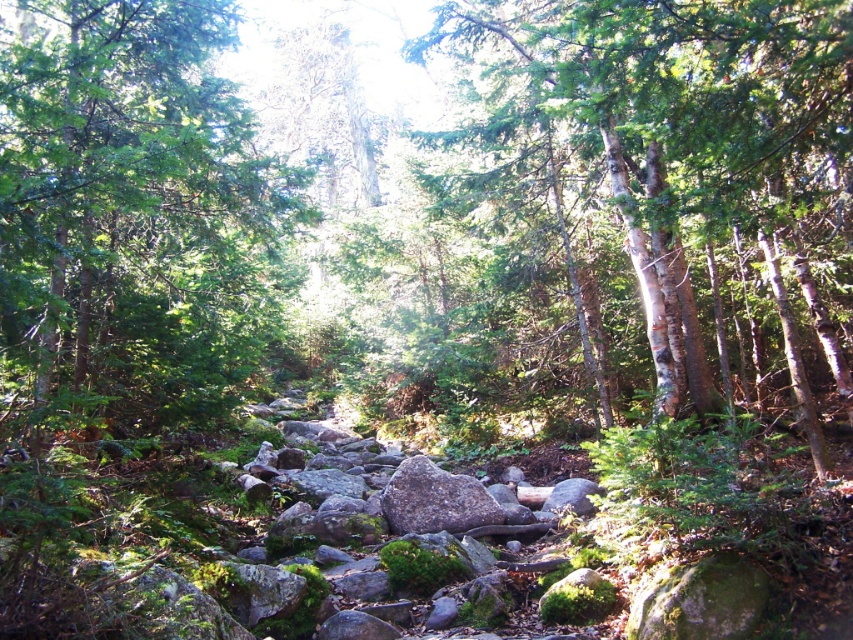
You are a hiker who wants to take a photo of both the smooth bark tree at center and the green leafy tree at center. Since you want them both in the frame, which tree should you stand closer to when taking the photo?

You should stand closer to the green leafy tree at center because it is shorter than the smooth bark tree at center. This way, both trees will appear balanced in the photo frame.

You are a hiker walking along the rocky path in the forest scene. You notice two trees at the center of your view. Which tree would you encounter first as you continue walking forward? The smooth bark tree at center or the green leafy tree at center?

The smooth bark tree at center is closer to you, so you would encounter it first before reaching the green leafy tree at center.